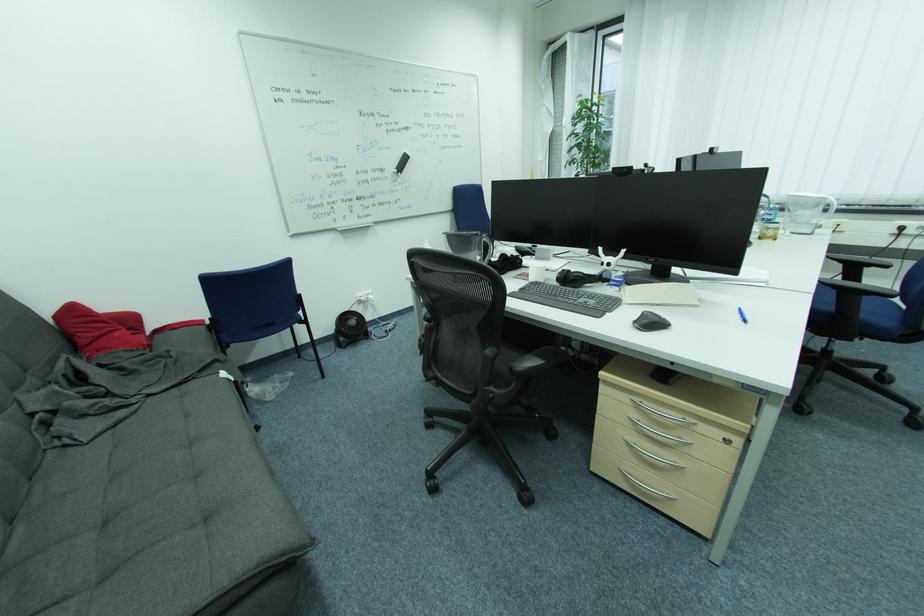
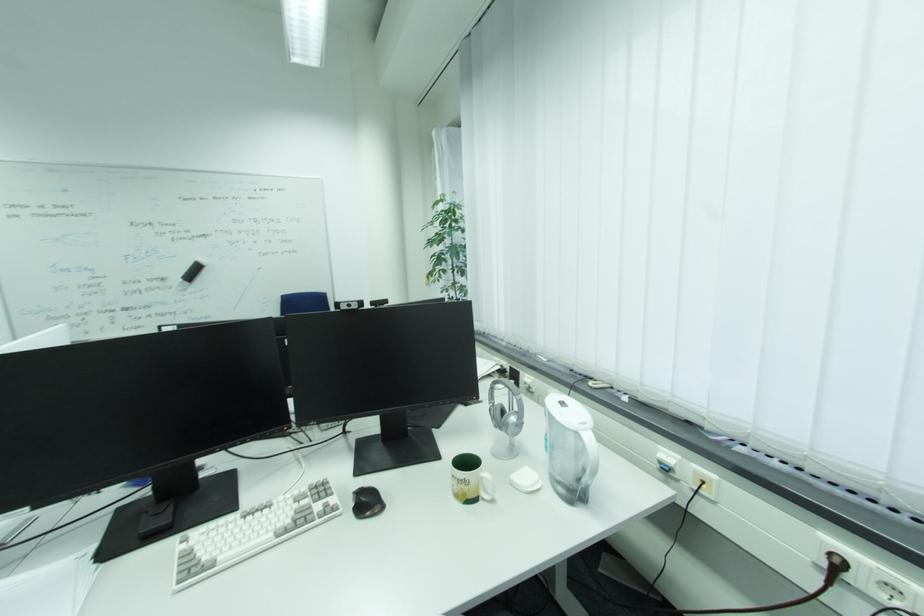
Where in the second image is the point corresponding to pixel 403 169 from the first image?

(189, 278)